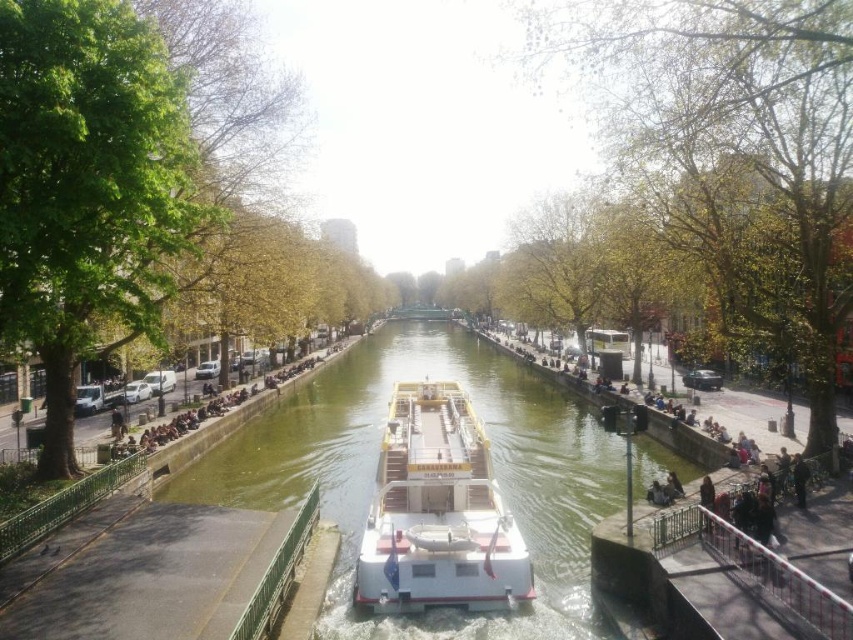
Who is lower down, green leafy tree at left or white matte boat at center?

white matte boat at center is below.

Can you confirm if green leafy tree at left is bigger than white matte boat at center?

Correct, green leafy tree at left is larger in size than white matte boat at center.

Who is more distant from viewer, (x=102, y=147) or (x=438, y=500)?

The point (x=438, y=500) is behind.

The image size is (853, 640). In order to click on green leafy tree at left in this screenshot , I will do `click(88, 186)`.

Image resolution: width=853 pixels, height=640 pixels. Describe the element at coordinates (730, 154) in the screenshot. I see `green leafy tree at center` at that location.

Can you confirm if green leafy tree at center is positioned above green leafy tree at left?

Yes, green leafy tree at center is above green leafy tree at left.

The height and width of the screenshot is (640, 853). In order to click on green leafy tree at center in this screenshot , I will do (x=730, y=154).

Which is more to the left, green leafy tree at center or green smooth water at center?

green smooth water at center is more to the left.

Is point (776, 81) positioned before point (263, 465)?

Yes, point (776, 81) is closer to viewer.

Between point (773, 112) and point (199, 468), which one is positioned in front?

Positioned in front is point (773, 112).

The width and height of the screenshot is (853, 640). I want to click on green leafy tree at center, so click(730, 154).